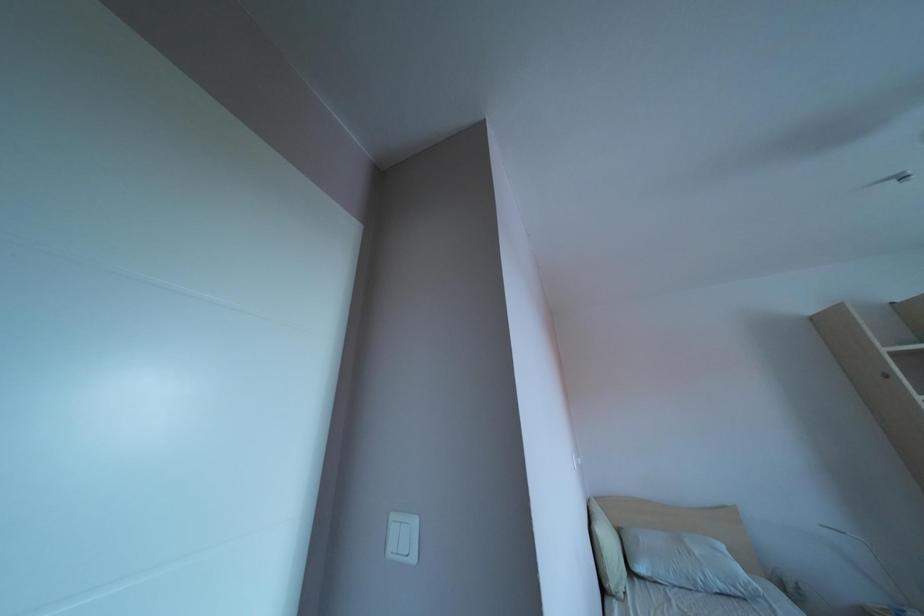
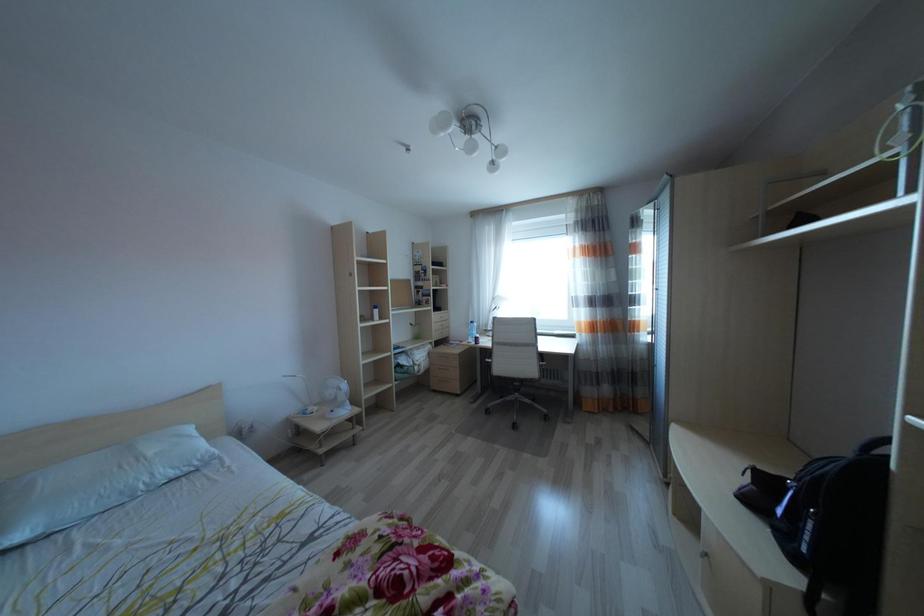
Question: Based on the continuous images, in which direction is the camera rotating? Reply with the corresponding letter.

Choices:
 (A) Left
 (B) Right
 (C) Up
 (D) Down

Answer: (B)